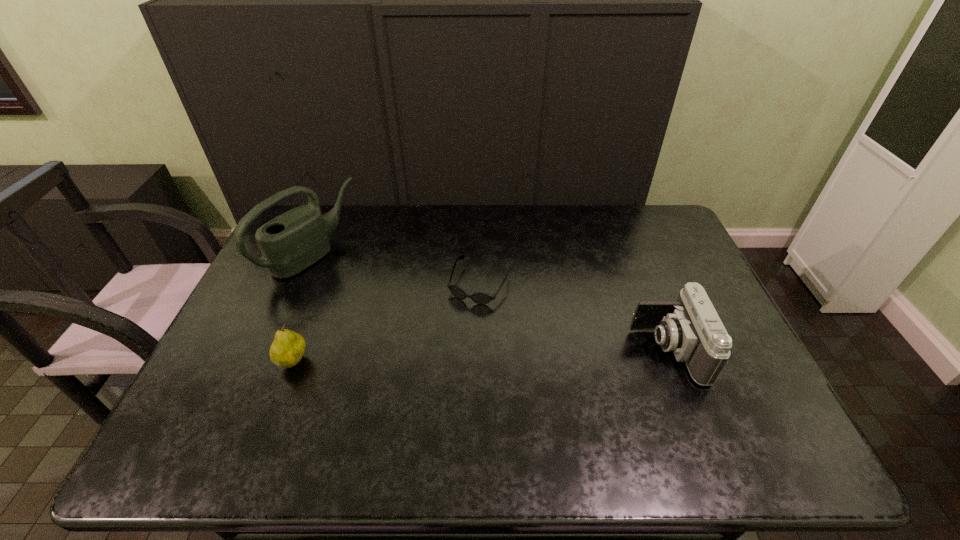
What are the coordinates of `object positioned at the near right corner` in the screenshot? It's located at [690, 327].

You are a GUI agent. You are given a task and a screenshot of the screen. Output one action in this format:
    pyautogui.click(x=<x>, y=<y>)
    Task: Click on the vacant space at the far edge
    The height and width of the screenshot is (540, 960).
    Given the screenshot: What is the action you would take?
    pyautogui.click(x=347, y=245)

In the image, there is a desktop. Where is `vacant space at the near edge`? vacant space at the near edge is located at coordinates (382, 398).

In order to click on free space at the left edge of the desktop in this screenshot , I will do `click(240, 329)`.

The height and width of the screenshot is (540, 960). I want to click on vacant region at the right edge, so click(x=737, y=370).

Locate an element on the screen. The image size is (960, 540). free spot between the sunglasses and the third tallest object is located at coordinates (387, 322).

Image resolution: width=960 pixels, height=540 pixels. I want to click on free space between the pear and the rightmost object, so click(480, 356).

The height and width of the screenshot is (540, 960). Find the location of `vacant point located between the pear and the rightmost object`. vacant point located between the pear and the rightmost object is located at coordinates (480, 356).

Find the location of a particular element. free spot between the second object from right to left and the camera is located at coordinates (573, 317).

Locate an element on the screen. This screenshot has width=960, height=540. free space between the pear and the rightmost object is located at coordinates (480, 356).